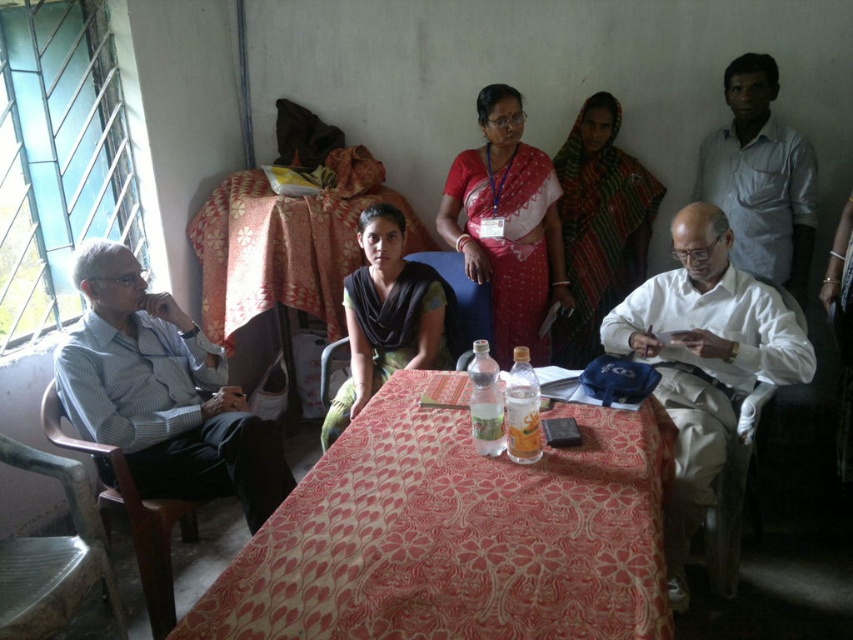
You are organizing a small event and need to determine seating arrangements. The room has a table that can accommodate two people comfortably. If you want to seat the person wearing the matte red saree at center and the person in the white cotton shirt at upper right together, will their clothing sizes affect the seating space? Explain your reasoning.

The matte red saree at center has a larger width than the white cotton shirt at upper right. However, seating space is determined by the physical dimensions of the individuals, not the size of their clothing. Therefore, the clothing sizes will not directly affect the seating space as long as the table can comfortably fit two people.

Based on the provided scene description, what are the coordinates of the floral fabric tablecloth at center?

The floral fabric tablecloth at center is located at coordinates (286, 244).